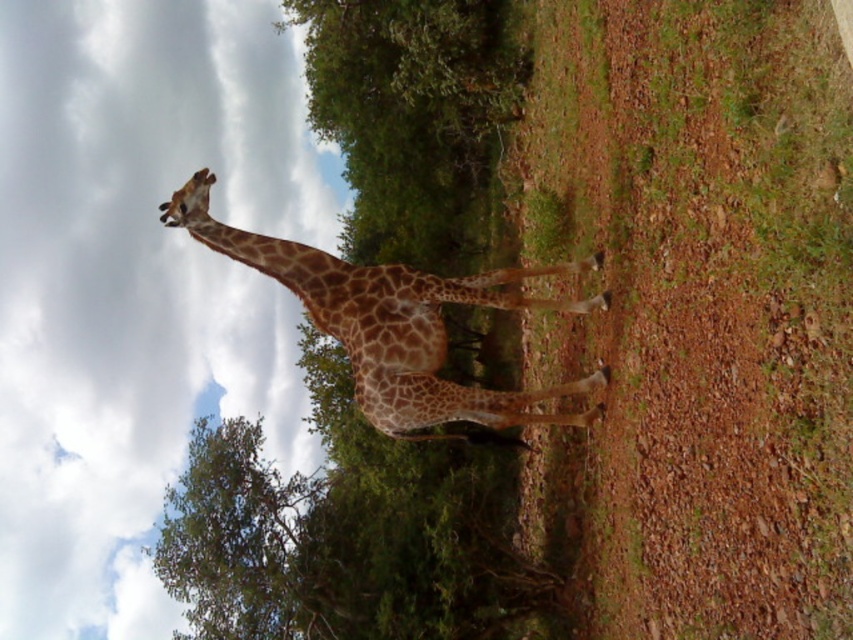
You are a small animal trying to hide from predators in the savanna. You see the brown textured grass at center and the spotted fur giraffe at center. Which location would provide better camouflage?

The brown textured grass at center is much taller than the spotted fur giraffe at center, so hiding in the grass would provide better camouflage as it can conceal your height and blend with the surroundings.

You are a photographer trying to capture the spotted fur giraffe at center. You notice the brown textured grass at center is blocking your view. Can you move the grass to get a clear shot of the giraffe?

The brown textured grass at center is positioned over spotted fur giraffe at center, so you cannot move the grass since it is part of the scene and blocking the view.

You are a photographer trying to capture the spotted fur giraffe at center in your shot. You notice there is brown textured grass at center in the frame. Which object is wider in the image?

The brown textured grass at center is wider than the spotted fur giraffe at center according to the description.